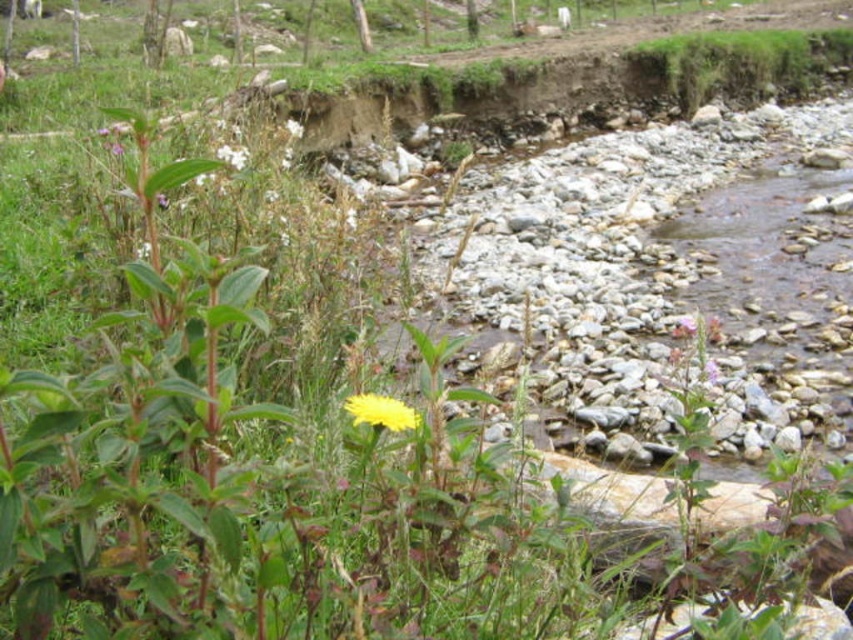
Who is more forward, (387, 408) or (241, 154)?

Point (387, 408) is in front.

Does yellow matte flower at center lie behind white fluffy flower at upper left?

No, yellow matte flower at center is in front of white fluffy flower at upper left.

Who is more forward, (399, 424) or (236, 154)?

Point (399, 424) is more forward.

This screenshot has height=640, width=853. I want to click on yellow matte flower at center, so click(380, 412).

Does yellow matte flower at center lie behind pink matte flower at center-right?

That is False.

Is yellow matte flower at center smaller than pink matte flower at center-right?

Yes, yellow matte flower at center is smaller than pink matte flower at center-right.

The height and width of the screenshot is (640, 853). Describe the element at coordinates (380, 412) in the screenshot. I see `yellow matte flower at center` at that location.

You are a GUI agent. You are given a task and a screenshot of the screen. Output one action in this format:
    pyautogui.click(x=<x>, y=<y>)
    Task: Click on the yellow matte flower at center
    This screenshot has width=853, height=640.
    Given the screenshot: What is the action you would take?
    pyautogui.click(x=380, y=412)

Which is in front, point (238, 163) or point (683, 333)?

Point (238, 163)

Is point (216, 152) closer to viewer compared to point (682, 330)?

Yes.

Image resolution: width=853 pixels, height=640 pixels. Identify the location of white fluffy flower at upper left. (231, 156).